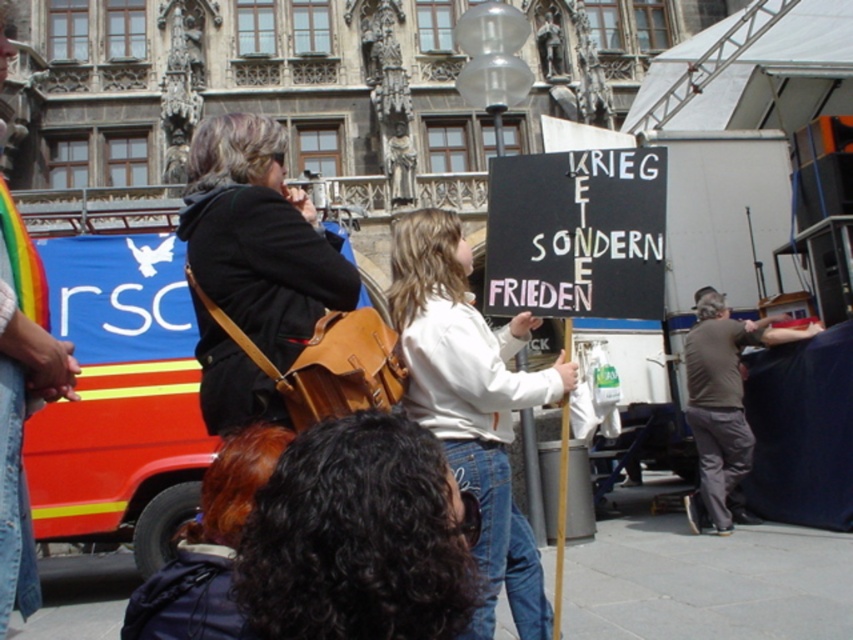
Question: Considering the real-world distances, which object is farthest from the denim jacket at lower left?

Choices:
 (A) matte black jacket at center
 (B) white cotton shirt at center
 (C) black curly hair at center
 (D) brown cotton shirt at right

Answer: (D)

Question: Is matte black jacket at center bigger than denim jacket at lower left?

Choices:
 (A) yes
 (B) no

Answer: (B)

Question: Which of these objects is positioned closest to the matte black jacket at center?

Choices:
 (A) white cotton shirt at center
 (B) brown cotton shirt at right

Answer: (A)

Question: Can you confirm if black curly hair at center is smaller than matte black jacket at center?

Choices:
 (A) no
 (B) yes

Answer: (B)

Question: Can you confirm if black curly hair at center is positioned to the left of matte black jacket at center?

Choices:
 (A) no
 (B) yes

Answer: (A)

Question: Which point is closer to the camera?

Choices:
 (A) (4, 305)
 (B) (459, 620)
 (C) (720, 413)
 (D) (637, 173)

Answer: (B)